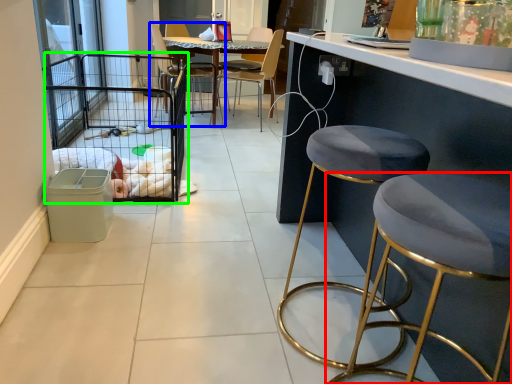
Question: Estimate the real-world distances between objects in this image. Which object is farther from stool (highlighted by a red box), chair (highlighted by a blue box) or cage (highlighted by a green box)?

Choices:
 (A) chair
 (B) cage

Answer: (A)